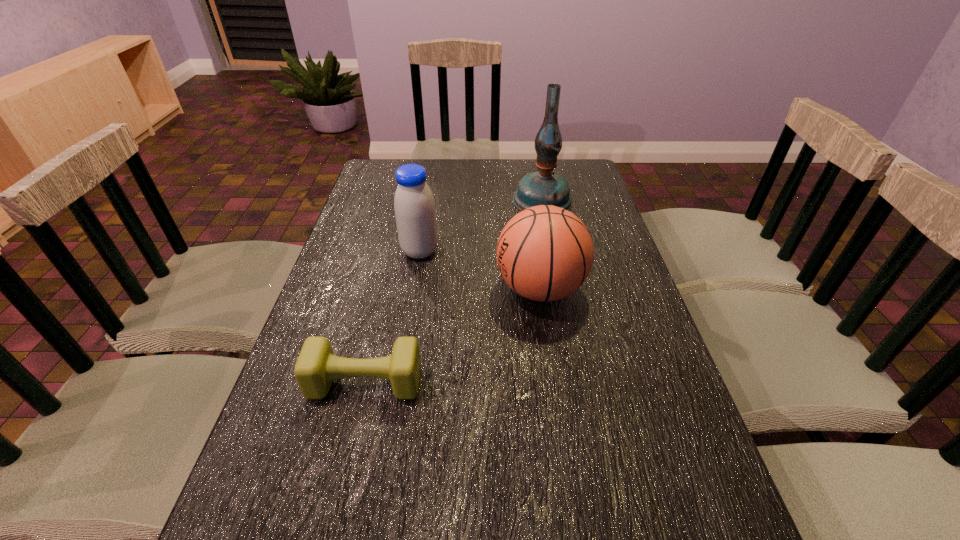
Locate an element on the screen. vacant region located 0.200m on the surface of the basketball near the brand logo is located at coordinates (419, 289).

Find the location of a particular element. The width and height of the screenshot is (960, 540). vacant region located on the right of the shortest object is located at coordinates (458, 382).

Identify the location of object at the far edge. This screenshot has width=960, height=540. (543, 187).

Where is `object positioned at the left edge`? This screenshot has width=960, height=540. object positioned at the left edge is located at coordinates (316, 367).

I want to click on oil lamp located at the right edge, so click(543, 187).

Identify the location of basketball that is positioned at the right edge. Image resolution: width=960 pixels, height=540 pixels. (544, 253).

Where is `object located in the far right corner section of the desktop`? This screenshot has width=960, height=540. object located in the far right corner section of the desktop is located at coordinates (543, 187).

In the image, there is a desktop. Where is `blank space at the far edge`? Image resolution: width=960 pixels, height=540 pixels. blank space at the far edge is located at coordinates (510, 169).

At what (x,y) coordinates should I click in order to perform the action: click on free space at the left edge of the desktop. Please return your answer as a coordinate pair (x, y). This screenshot has height=540, width=960. Looking at the image, I should click on (369, 319).

Find the location of `vacant space at the right edge of the desktop`. vacant space at the right edge of the desktop is located at coordinates (634, 293).